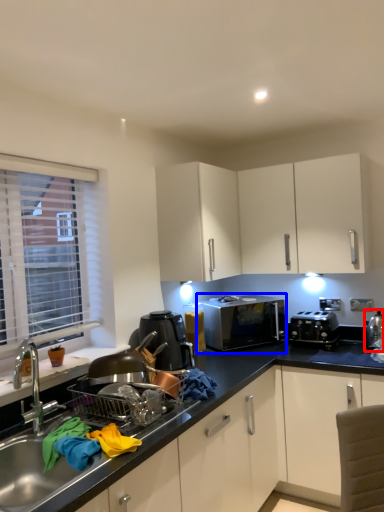
Question: Which object appears farthest to the camera in this image, appliance (highlighted by a red box) or microwave oven (highlighted by a blue box)?

Choices:
 (A) appliance
 (B) microwave oven

Answer: (B)